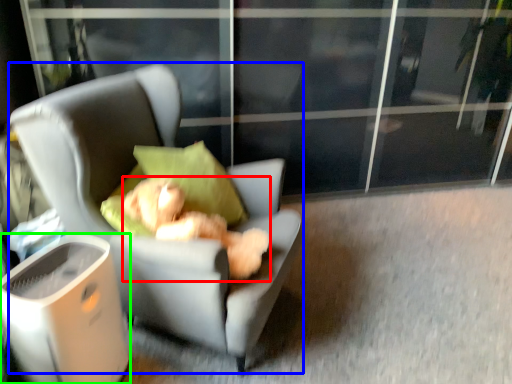
Question: Estimate the real-world distances between objects in this image. Which object is closer to teddy bear (highlighted by a red box), chair (highlighted by a blue box) or trash bin/can (highlighted by a green box)?

Choices:
 (A) chair
 (B) trash bin/can

Answer: (A)